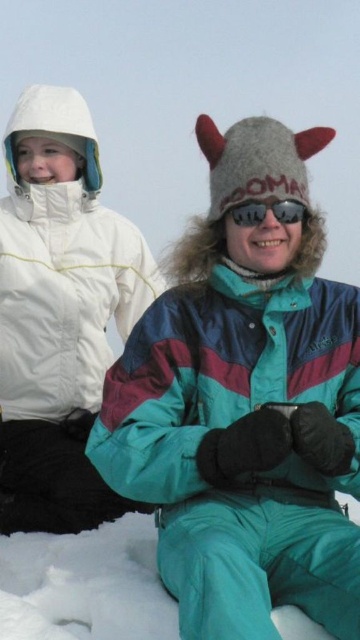
You are standing in the snow and see the white matte jacket at upper left. Where exactly is it located in terms of coordinates?

The white matte jacket at upper left is located at point [60,314].

You are a photographer trying to capture both the white matte jacket at upper left and the sunglasses at center in a single frame. Based on their positions, which object should you focus on first to ensure both are in the shot?

You should focus on the white matte jacket at upper left first because it is taller than the sunglasses at center, so it will occupy more space in the frame and help you adjust the composition to include both.

You are designing a layout for a winter apparel catalog. You have a photo of two people in winter gear. The scene includes a white matte jacket at upper left and sunglasses at center. The catalog requires knowing which item is wider to place them appropriately. Which object is wider?

The white matte jacket at upper left is wider than the sunglasses at center according to the description.